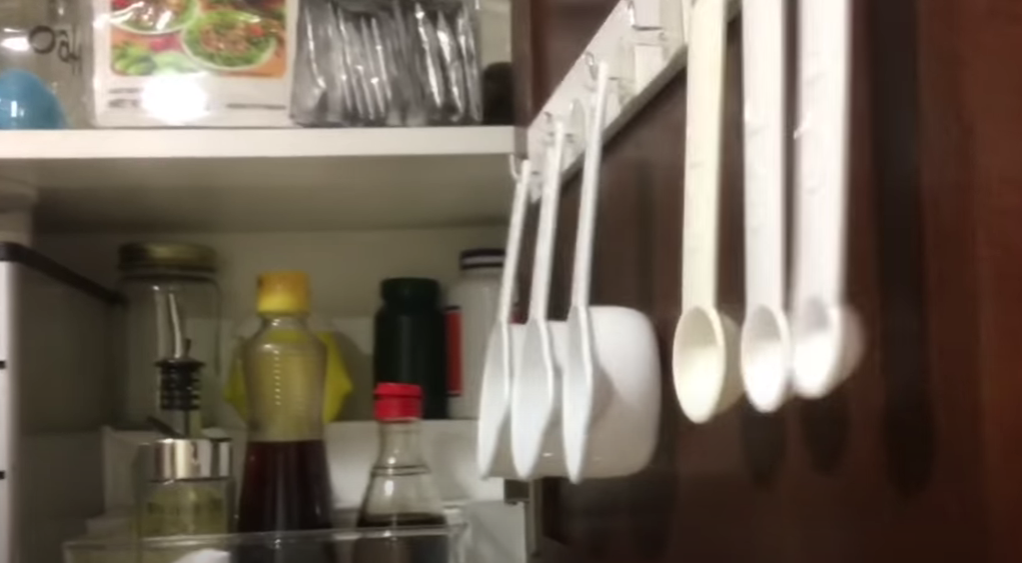
I want to click on white measuring cups, so click(x=491, y=382), click(x=530, y=387), click(x=599, y=388).